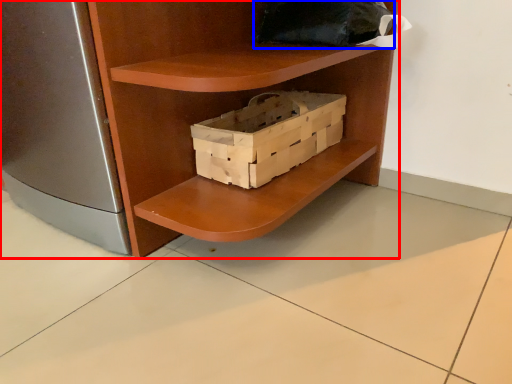
Question: Which object is closer to the camera taking this photo, shelf (highlighted by a red box) or pillow (highlighted by a blue box)?

Choices:
 (A) shelf
 (B) pillow

Answer: (A)